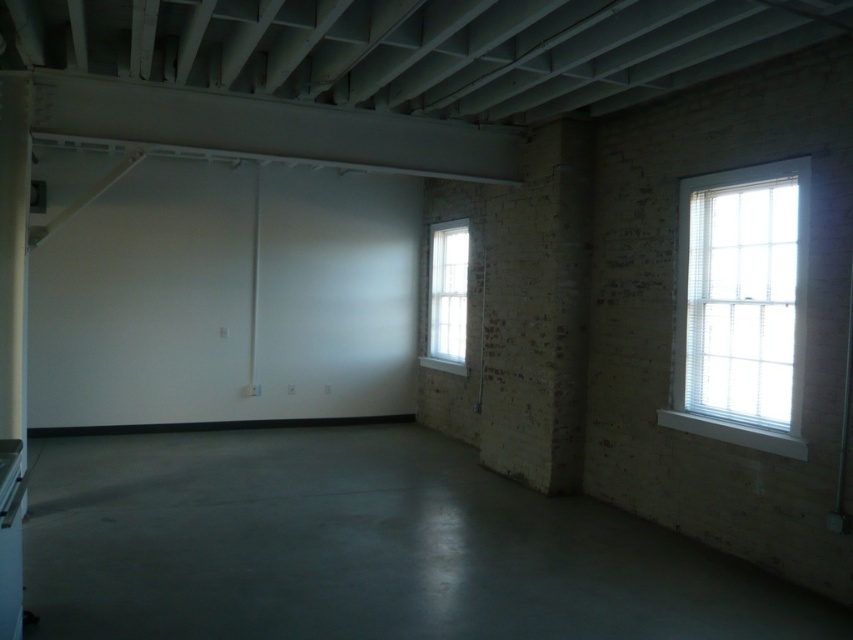
You are an interior designer planning to install a new lighting fixture. You have two options based on the available space near the windows. Which window would allow for a larger lighting fixture installation, the white wooden window at upper right or the white glass window at center?

The white glass window at center allows for a larger lighting fixture installation because it occupies more space than the white wooden window at upper right.